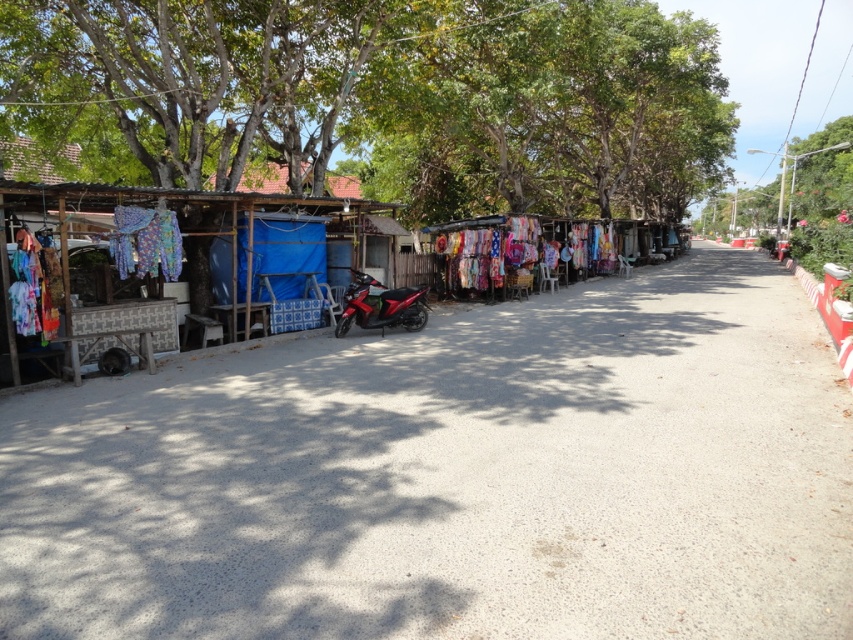
You are a customer at the market and want to find the glossy red motorcycle at center. From your current position, which direction should you look to see the colorful fabric at center first?

The colorful fabric at center is to the right of the glossy red motorcycle at center, so you should look to your right to see the colorful fabric at center first.

You are a customer at the market and want to walk from the wooden table at left to the glossy red motorcycle at center. Is there any obstruction between them?

The wooden table at left is positioned over the glossy red motorcycle at center, so there is an obstruction between them.